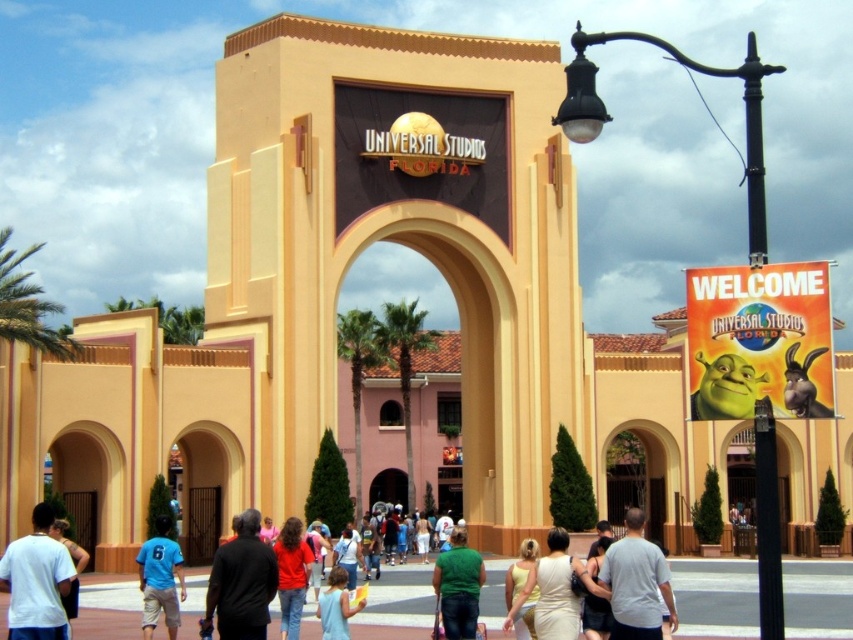
Question: Considering the relative positions of green matte shirt at center and matte yellow dress at center in the image provided, where is green matte shirt at center located with respect to matte yellow dress at center?

Choices:
 (A) left
 (B) right

Answer: (A)

Question: Considering the real-world distances, which object is closest to the black matte shirt at center?

Choices:
 (A) matte white shirt at lower left
 (B) gray cotton t-shirt at center
 (C) blue fabric shirt at lower left
 (D) light blue shirt at center

Answer: (D)

Question: Which point is farther to the camera?

Choices:
 (A) (282, 593)
 (B) (47, 584)
 (C) (537, 548)
 (D) (73, 614)

Answer: (A)

Question: Is black matte shirt at center bigger than matte yellow dress at center?

Choices:
 (A) yes
 (B) no

Answer: (B)

Question: Does matte red shirt at center have a greater width compared to matte yellow dress at center?

Choices:
 (A) yes
 (B) no

Answer: (A)

Question: Which of the following is the closest to the observer?

Choices:
 (A) white cotton shirt at lower left
 (B) matte red shirt at center
 (C) blue fabric shirt at lower left
 (D) light blue shirt at center

Answer: (A)